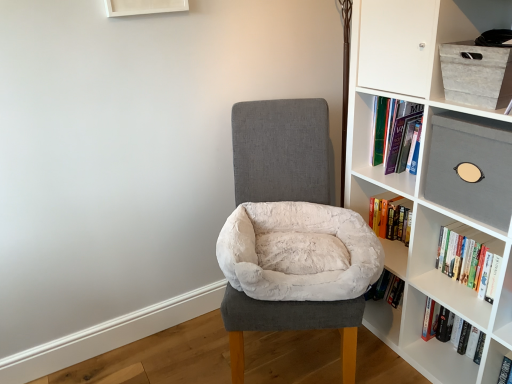
Question: Would you say white plush bean bag at center is to the left or to the right of hardcover book at right, the 2th book from the bottom, in the picture?

Choices:
 (A) left
 (B) right

Answer: (A)

Question: From a real-world perspective, relative to hardcover book at right, the 2th book from the bottom, is white plush bean bag at center vertically above or below?

Choices:
 (A) above
 (B) below

Answer: (A)

Question: Estimate the real-world distances between objects in this image. Which object is closer to the matte gray box at upper right?

Choices:
 (A) hardcover book at right, arranged as the first book when viewed from the top
 (B) white plush bean bag at center
 (C) white matte bookcase at right
 (D) white textured box at upper right
 (E) hardcover book at right, the second book positioned from the top

Answer: (C)

Question: Considering the real-world distances, which object is farthest from the white plush bean bag at center?

Choices:
 (A) matte gray box at upper right
 (B) hardcover book at right, which is the 1th book in bottom-to-top order
 (C) white textured box at upper right
 (D) white plush pet bed at center
 (E) white matte bookcase at right

Answer: (C)